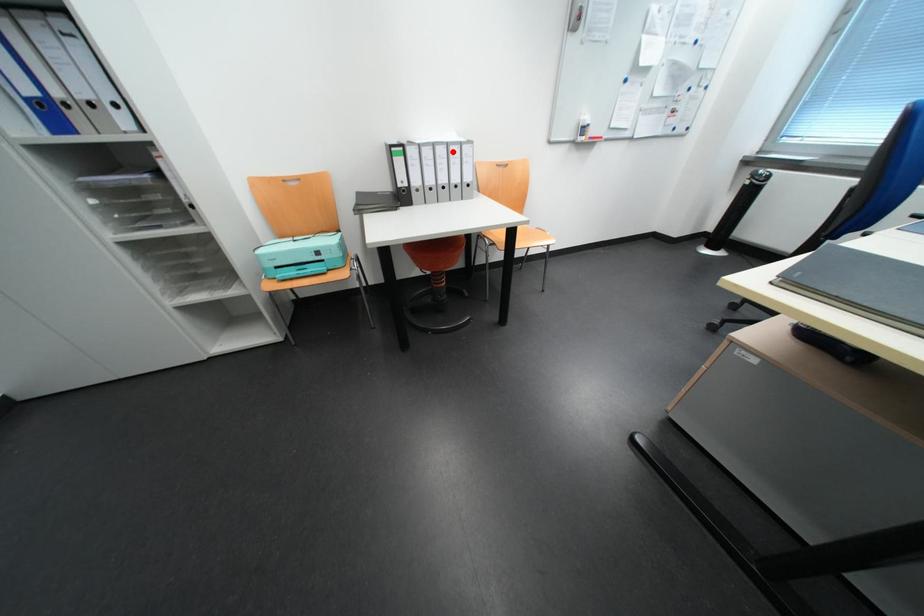
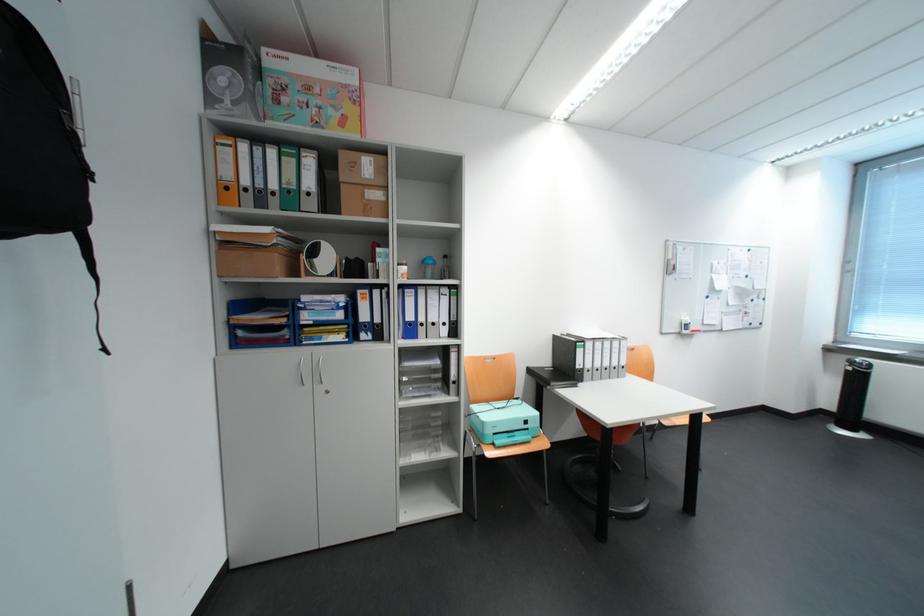
In the second image, find the point that corresponds to the highlighted location in the first image.

(618, 345)